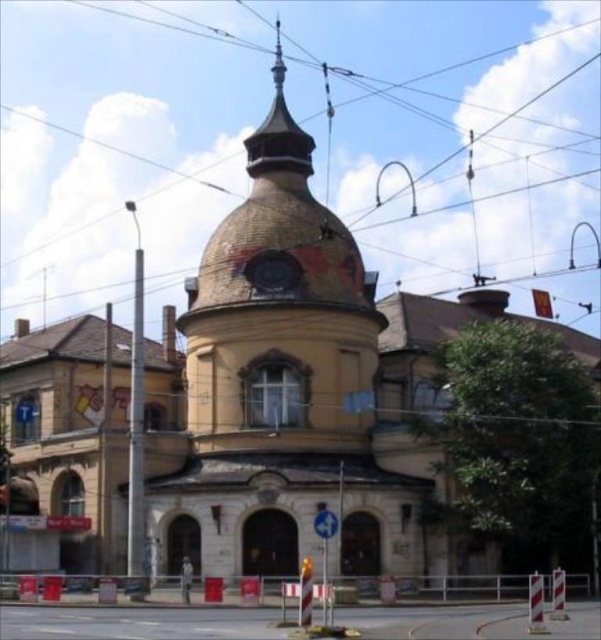
Who is positioned more to the right, brown textured dome at center or shiny silver spire at upper center?

brown textured dome at center

Is brown textured dome at center positioned behind shiny silver spire at upper center?

No, brown textured dome at center is closer to the viewer.

Between point (263, 252) and point (273, 65), which one is positioned behind?

The point (273, 65) is behind.

The image size is (601, 640). Identify the location of brown textured dome at center. (281, 237).

Which of these two, brown textured dome at center or gold textured spire at upper center, stands taller?

Standing taller between the two is gold textured spire at upper center.

Is point (293, 236) closer to camera compared to point (254, 172)?

Yes.

Is point (236, 230) farther from viewer compared to point (281, 129)?

No, it is in front of (281, 129).

This screenshot has width=601, height=640. I want to click on brown textured dome at center, so click(281, 237).

Can you confirm if gold textured spire at upper center is taller than shiny silver spire at upper center?

Indeed, gold textured spire at upper center has a greater height compared to shiny silver spire at upper center.

Is gold textured spire at upper center above shiny silver spire at upper center?

No, gold textured spire at upper center is not above shiny silver spire at upper center.

This screenshot has width=601, height=640. What are the coordinates of `gold textured spire at upper center` in the screenshot? It's located at (278, 131).